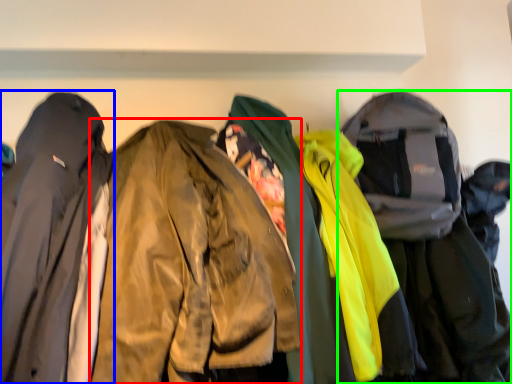
Question: Which object is the closest to the jacket (highlighted by a red box)? Choose among these: jacket (highlighted by a blue box) or jacket (highlighted by a green box).

Choices:
 (A) jacket
 (B) jacket

Answer: (A)